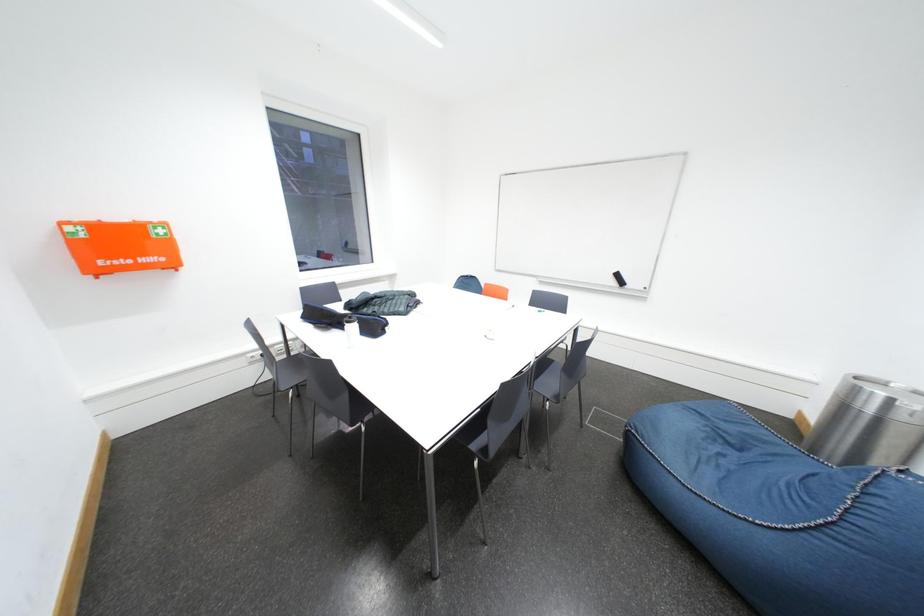
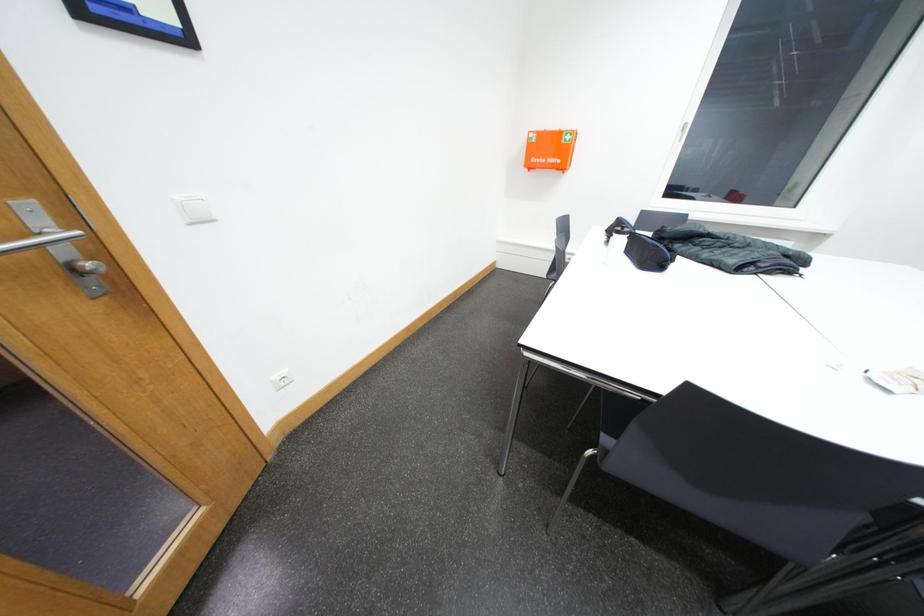
The images are taken continuously from a first-person perspective. In which direction is your viewpoint rotating?

The camera's rotation is toward left-down.